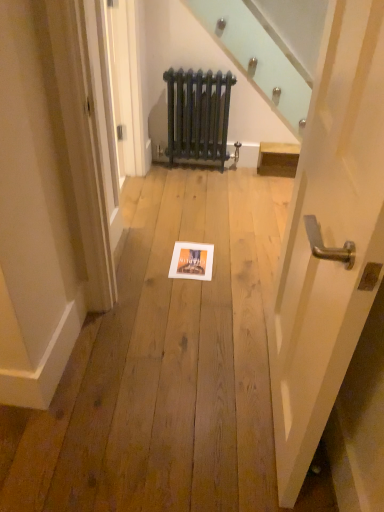
Identify the location of vacant space that is to the left of matte white picture frame at center. The width and height of the screenshot is (384, 512). (139, 266).